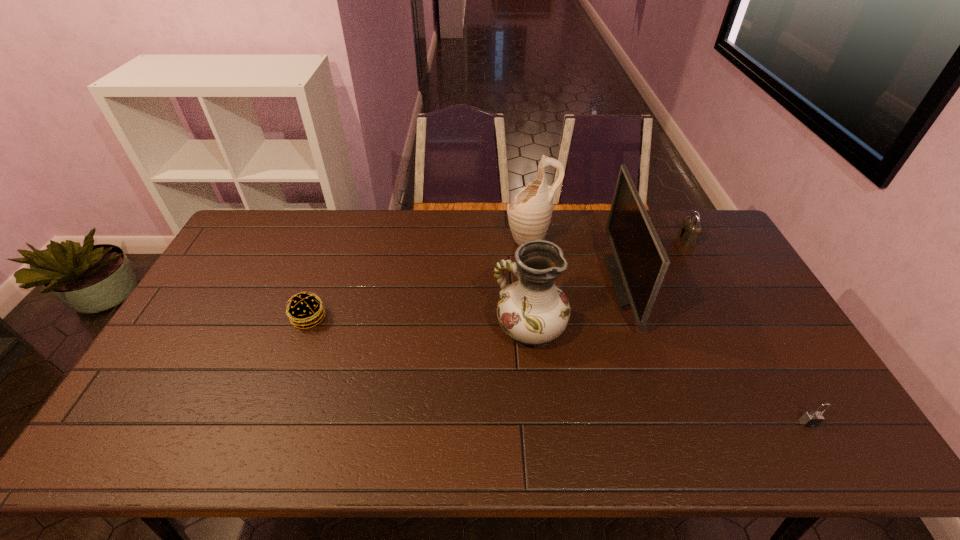
Find the location of `blank space located at the spout of the pitcher`. blank space located at the spout of the pitcher is located at coordinates (469, 240).

Where is `vacant space located 0.070m on the screen side of the monitor`? vacant space located 0.070m on the screen side of the monitor is located at coordinates (590, 282).

This screenshot has height=540, width=960. I want to click on vacant space situated on the screen side of the monitor, so click(593, 282).

This screenshot has width=960, height=540. Identify the location of free space located on the screen side of the monitor. (497, 282).

Locate an element on the screen. vacant position located 0.400m on the right of the vase is located at coordinates (704, 329).

Locate an element on the screen. This screenshot has width=960, height=540. vacant space situated 0.390m at the front of the farther padlock near the keyhole is located at coordinates (571, 240).

Identify the location of vacant space located at the front of the farther padlock near the keyhole. This screenshot has height=540, width=960. (573, 240).

What are the coordinates of `free location located 0.260m at the front of the farther padlock near the keyhole` in the screenshot? It's located at (607, 240).

You are a GUI agent. You are given a task and a screenshot of the screen. Output one action in this format:
    pyautogui.click(x=<x>, y=<y>)
    Task: Click on the free space located on the right of the leftmost object
    
    Given the screenshot: What is the action you would take?
    pyautogui.click(x=383, y=318)

The width and height of the screenshot is (960, 540). I want to click on pitcher that is at the far edge, so click(x=529, y=215).